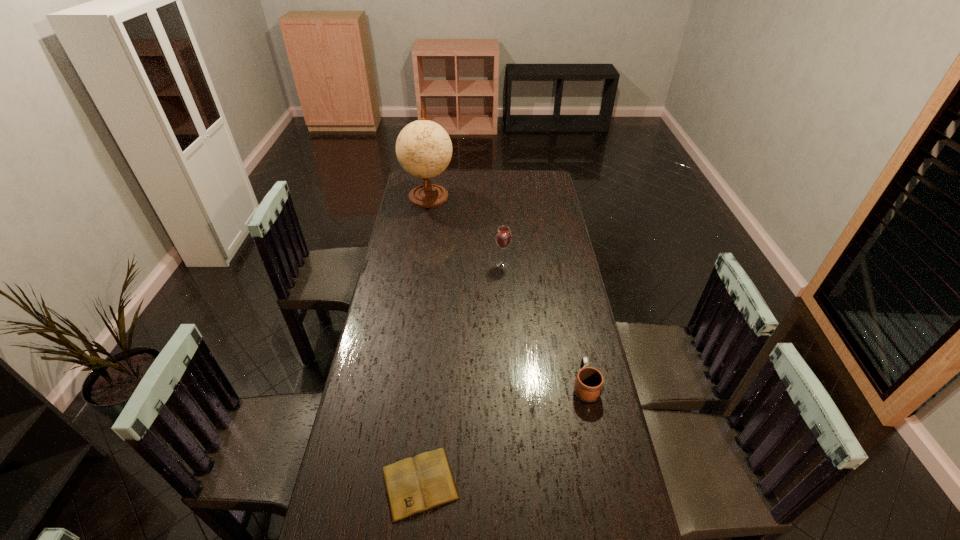
Image resolution: width=960 pixels, height=540 pixels. Identify the location of empty space between the third object from left to right and the second shortest object. (543, 325).

Where is `empty space that is in between the nearest object and the third object from left to right`? Image resolution: width=960 pixels, height=540 pixels. empty space that is in between the nearest object and the third object from left to right is located at coordinates (461, 374).

At what (x,y) coordinates should I click in order to perform the action: click on free space between the wineglass and the book. Please return your answer as a coordinate pair (x, y). Looking at the image, I should click on (461, 374).

Identify which object is the second closest to the book. Please provide its 2D coordinates. Your answer should be formatted as a tuple, i.e. [(x, y)], where the tuple contains the x and y coordinates of a point satisfying the conditions above.

[(503, 237)]

Point out which object is positioned as the third nearest to the mug. Please provide its 2D coordinates. Your answer should be formatted as a tuple, i.e. [(x, y)], where the tuple contains the x and y coordinates of a point satisfying the conditions above.

[(423, 148)]

Locate an element on the screen. This screenshot has width=960, height=540. free space that satisfies the following two spatial constraints: 1. on the surface of the farthest object; 2. on the left side of the book is located at coordinates (382, 483).

Locate an element on the screen. Image resolution: width=960 pixels, height=540 pixels. free space that satisfies the following two spatial constraints: 1. on the surface of the second farthest object; 2. on the left side of the tallest object is located at coordinates (418, 264).

Locate an element on the screen. vacant space that satisfies the following two spatial constraints: 1. on the surface of the tallest object; 2. on the left side of the third object from left to right is located at coordinates (418, 264).

Locate an element on the screen. The height and width of the screenshot is (540, 960). vacant space that satisfies the following two spatial constraints: 1. on the surface of the tallest object; 2. on the right side of the nearest object is located at coordinates (382, 483).